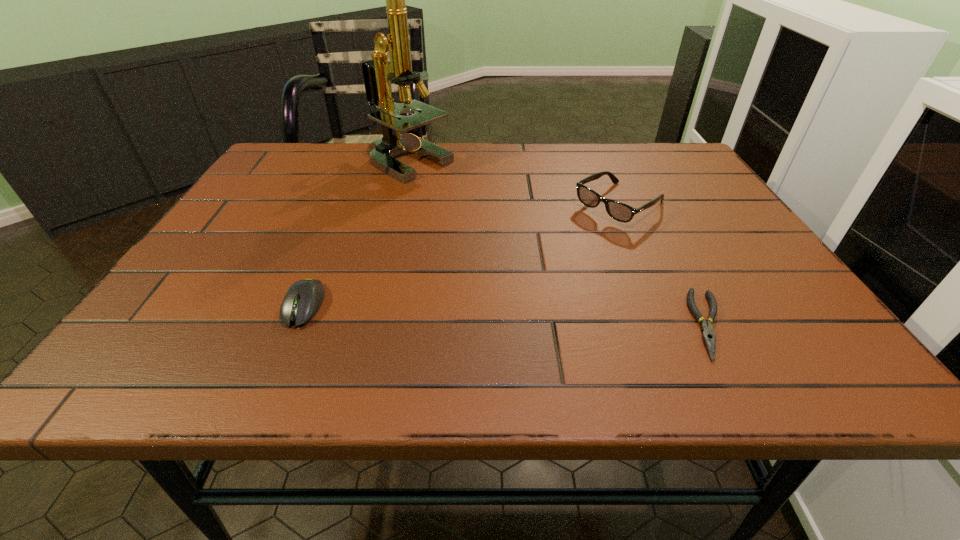
You are a GUI agent. You are given a task and a screenshot of the screen. Output one action in this format:
    pyautogui.click(x=<x>, y=<y>)
    Task: Click on the vacant space situated on the lenses of the spectacles
    
    Given the screenshot: What is the action you would take?
    pyautogui.click(x=553, y=249)

The image size is (960, 540). What are the coordinates of `microscope located in the far edge section of the desktop` in the screenshot? It's located at (377, 72).

The width and height of the screenshot is (960, 540). In order to click on spectacles situated at the far edge in this screenshot , I will do `click(621, 212)`.

At what (x,y) coordinates should I click in order to perform the action: click on computer mouse at the near edge. Please return your answer as a coordinate pair (x, y). The height and width of the screenshot is (540, 960). Looking at the image, I should click on (304, 298).

This screenshot has width=960, height=540. Identify the location of pliers situated at the near edge. (707, 329).

Identify the location of pliers at the right edge. (707, 329).

Find the location of a particular element. Image resolution: width=960 pixels, height=540 pixels. spectacles that is at the right edge is located at coordinates (621, 212).

The image size is (960, 540). What are the coordinates of `object positioned at the far right corner` in the screenshot? It's located at click(621, 212).

At what (x,y) coordinates should I click in order to perform the action: click on object situated at the near right corner. Please return your answer as a coordinate pair (x, y). The width and height of the screenshot is (960, 540). Looking at the image, I should click on (707, 329).

Image resolution: width=960 pixels, height=540 pixels. Find the location of `vacant space at the far edge of the desktop`. vacant space at the far edge of the desktop is located at coordinates (342, 160).